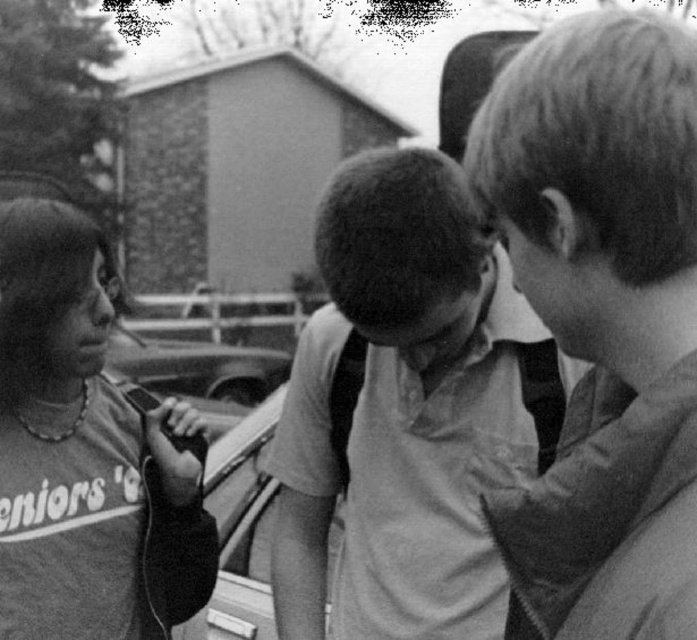
Between point (344, 468) and point (84, 342), which one is positioned in front?

Point (344, 468) is more forward.

Which of these two, smooth white shirt at center or matte gray sweatshirt at left, stands taller?

With more height is matte gray sweatshirt at left.

What do you see at coordinates (406, 410) in the screenshot?
I see `smooth white shirt at center` at bounding box center [406, 410].

Locate an element on the screen. smooth white shirt at center is located at coordinates (406, 410).

Is smooth brown hair at upper right further to the viewer compared to matte gray sweatshirt at left?

No, smooth brown hair at upper right is in front of matte gray sweatshirt at left.

Is point (544, 32) in front of point (61, 220)?

No, (544, 32) is further to viewer.

Find the location of a particular element. smooth brown hair at upper right is located at coordinates (604, 316).

Find the location of a particular element. This screenshot has height=640, width=697. smooth brown hair at upper right is located at coordinates (604, 316).

Who is more forward, (657, 576) or (443, 273)?

Positioned in front is point (657, 576).

Who is lower down, smooth brown hair at upper right or smooth white shirt at center?

Positioned lower is smooth white shirt at center.

Locate an element on the screen. This screenshot has width=697, height=640. smooth brown hair at upper right is located at coordinates (604, 316).

This screenshot has height=640, width=697. Find the location of `smooth brown hair at upper right`. smooth brown hair at upper right is located at coordinates (604, 316).